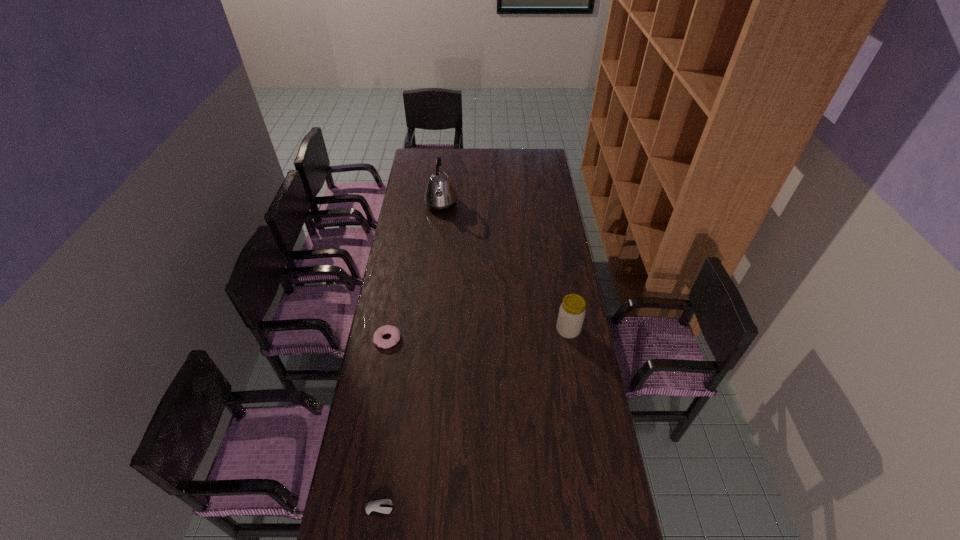
The image size is (960, 540). Find the location of `the farthest object`. the farthest object is located at coordinates (440, 195).

This screenshot has width=960, height=540. I want to click on kettle, so click(440, 195).

Find the location of a particular element. jar is located at coordinates (571, 315).

The width and height of the screenshot is (960, 540). Identify the location of the third shortest object. (571, 315).

Image resolution: width=960 pixels, height=540 pixels. Find the location of `doughnut`. doughnut is located at coordinates (x=387, y=329).

Find the location of a particular element. Image resolution: width=960 pixels, height=540 pixels. mouse is located at coordinates (382, 507).

I want to click on vacant space located 0.280m from the spout of the farthest object, so click(510, 205).

I want to click on vacant point located on the front of the third shortest object, so click(x=581, y=401).

This screenshot has width=960, height=540. In order to click on vacant point located 0.340m on the right of the doughnut in this screenshot , I will do `click(485, 339)`.

Locate an element on the screen. Image resolution: width=960 pixels, height=540 pixels. vacant space situated on the right of the nearest object is located at coordinates (504, 508).